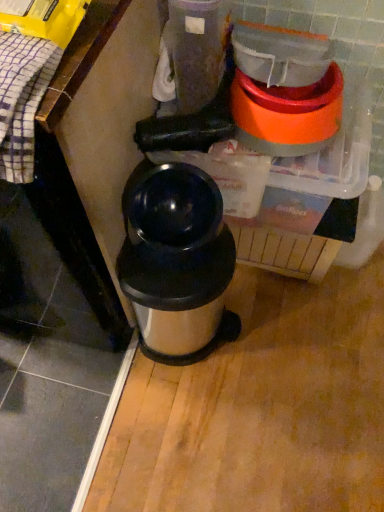
Locate an element on the screen. The width and height of the screenshot is (384, 512). free space above orange plastic blender at upper right (from a real-world perspective) is located at coordinates (297, 95).